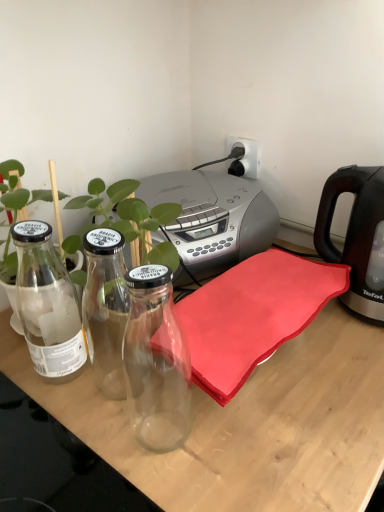
Locate an element on the screen. The image size is (384, 512). white plastic electric outlet at upper center is located at coordinates (244, 157).

You are a GUI agent. You are given a task and a screenshot of the screen. Output one action in this format:
    pyautogui.click(x=<x>, y=<y>)
    Task: Click on the white plastic electric outlet at upper center
    
    Given the screenshot: What is the action you would take?
    pyautogui.click(x=244, y=157)

From a real-world perspective, is transparent glass bottles at left beneath black plastic kettle at right?

Indeed, from a real-world perspective, transparent glass bottles at left is positioned beneath black plastic kettle at right.

Who is bigger, transparent glass bottles at left or black plastic kettle at right?

Bigger between the two is transparent glass bottles at left.

I want to click on kettle located above the transparent glass bottles at left (from a real-world perspective), so click(355, 234).

Who is shorter, transparent glass bottles at left or black plastic kettle at right?

Standing shorter between the two is black plastic kettle at right.

Considering the relative positions of clear glass plant at center and transparent glass bottles at left in the image provided, is clear glass plant at center to the right of transparent glass bottles at left from the viewer's perspective?

No, clear glass plant at center is not to the right of transparent glass bottles at left.

Considering the relative sizes of clear glass plant at center and transparent glass bottles at left in the image provided, is clear glass plant at center wider than transparent glass bottles at left?

No, clear glass plant at center is not wider than transparent glass bottles at left.

How distant is clear glass plant at center from transparent glass bottles at left?

The distance of clear glass plant at center from transparent glass bottles at left is 9.76 inches.

Is clear glass plant at center aimed at transparent glass bottles at left?

No, clear glass plant at center is not oriented towards transparent glass bottles at left.

What's the angular difference between white plastic electric outlet at upper center and clear glass plant at center's facing directions?

The facing directions of white plastic electric outlet at upper center and clear glass plant at center are 86.6 degrees apart.

Can you confirm if white plastic electric outlet at upper center is smaller than clear glass plant at center?

Yes, white plastic electric outlet at upper center is smaller than clear glass plant at center.

Which point is more distant from viewer, [231,149] or [148,212]?

The point [231,149] is farther.

Is white plastic electric outlet at upper center touching clear glass plant at center?

No.

Can you tell me how much transparent glass bottles at left and green leafy plant at left differ in facing direction?

The angular difference between transparent glass bottles at left and green leafy plant at left is 2.61 degrees.

Does point (192, 426) appear closer or farther from the camera than point (2, 273)?

Clearly, point (192, 426) is closer to the camera than point (2, 273).

Is green leafy plant at left at the back of transparent glass bottles at left?

Yes, transparent glass bottles at left is positioned with its back facing green leafy plant at left.

Can you see transparent glass bottles at left touching green leafy plant at left?

No.

Between white plastic electric outlet at upper center and green leafy plant at left, which one appears on the right side from the viewer's perspective?

white plastic electric outlet at upper center is more to the right.

Would you say green leafy plant at left is part of white plastic electric outlet at upper center's contents?

Actually, green leafy plant at left is outside white plastic electric outlet at upper center.

Looking at this image, which object is wider, white plastic electric outlet at upper center or green leafy plant at left?

green leafy plant at left is wider.

Considering the sizes of clear glass plant at center and white plastic electric outlet at upper center in the image, is clear glass plant at center taller or shorter than white plastic electric outlet at upper center?

Considering their sizes, clear glass plant at center has more height than white plastic electric outlet at upper center.

Does clear glass plant at center have a lesser width compared to white plastic electric outlet at upper center?

No.

Considering the positions of points (121, 186) and (256, 169), is point (121, 186) closer to camera compared to point (256, 169)?

Yes, it is in front of point (256, 169).

Which object is further away from the camera taking this photo, clear glass plant at center or white plastic electric outlet at upper center?

Positioned behind is white plastic electric outlet at upper center.

Is black plastic kettle at right closer to camera compared to transparent glass bottles at left?

No.

Is black plastic kettle at right placed right next to transparent glass bottles at left?

black plastic kettle at right and transparent glass bottles at left are not in contact.

Considering the sizes of black plastic kettle at right and transparent glass bottles at left in the image, is black plastic kettle at right wider or thinner than transparent glass bottles at left?

In the image, black plastic kettle at right appears to be more narrow than transparent glass bottles at left.

Is black plastic kettle at right smaller than transparent glass bottles at left?

Indeed, black plastic kettle at right has a smaller size compared to transparent glass bottles at left.

Identify the location of kettle on the right side of transparent glass bottles at left. The width and height of the screenshot is (384, 512). (355, 234).

Find the location of a particular element. The width and height of the screenshot is (384, 512). plant located above the transparent glass bottles at left (from the image's perspective) is located at coordinates (131, 219).

When comparing their distances from green leafy plant at left, does clear glass plant at center or transparent glass bottles at left seem further?

transparent glass bottles at left.

Considering their positions, is clear glass plant at center positioned closer to black plastic kettle at right than transparent glass bottles at left?

transparent glass bottles at left is closer to black plastic kettle at right.

From the image, which object appears to be nearer to black plastic kettle at right, clear glass plant at center or white plastic electric outlet at upper center?

white plastic electric outlet at upper center is positioned closer to the anchor black plastic kettle at right.

When comparing their distances from green leafy plant at left, does transparent glass bottles at left or white plastic electric outlet at upper center seem closer?

transparent glass bottles at left lies closer to green leafy plant at left than the other object.

From the image, which object appears to be farther from black plastic kettle at right, white plastic electric outlet at upper center or green leafy plant at left?

Based on the image, green leafy plant at left appears to be further to black plastic kettle at right.

From the image, which object appears to be nearer to green leafy plant at left, clear glass plant at center or black plastic kettle at right?

clear glass plant at center is positioned closer to the anchor green leafy plant at left.

Estimate the real-world distances between objects in this image. Which object is further from white plastic electric outlet at upper center, black plastic kettle at right or clear glass plant at center?

clear glass plant at center is further to white plastic electric outlet at upper center.

Which object lies nearer to the anchor point black plastic kettle at right, green leafy plant at left or white plastic electric outlet at upper center?

Based on the image, white plastic electric outlet at upper center appears to be nearer to black plastic kettle at right.

This screenshot has height=512, width=384. Identify the location of houseplant positioned between transparent glass bottles at left and white plastic electric outlet at upper center from near to far. (22, 192).

Locate an element on the screen. This screenshot has height=512, width=384. kettle between clear glass plant at center and white plastic electric outlet at upper center from front to back is located at coordinates (355, 234).

Find the location of a particular element. This screenshot has width=384, height=512. electric outlet situated between green leafy plant at left and black plastic kettle at right from left to right is located at coordinates (244, 157).

Locate an element on the screen. The image size is (384, 512). plant situated between green leafy plant at left and black plastic kettle at right from left to right is located at coordinates (131, 219).